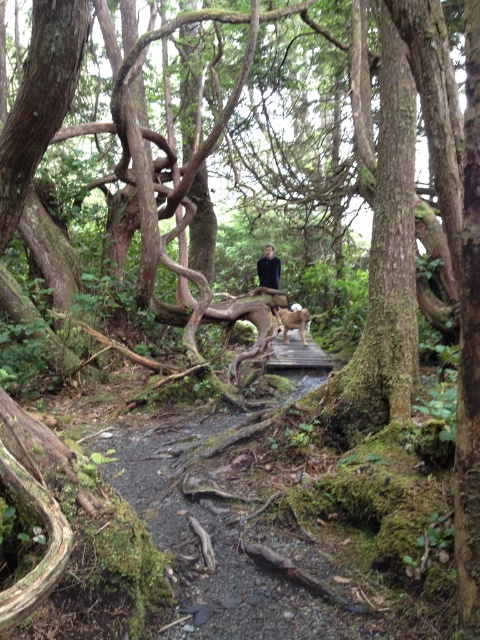
Question: Does black matte shirt at center appear on the right side of brown furry dog at center?

Choices:
 (A) no
 (B) yes

Answer: (A)

Question: Which of the following is the closest to the observer?

Choices:
 (A) (260, 269)
 (B) (289, 310)

Answer: (B)

Question: Is black matte shirt at center in front of brown furry dog at center?

Choices:
 (A) no
 (B) yes

Answer: (A)

Question: Is black matte shirt at center positioned in front of brown furry dog at center?

Choices:
 (A) yes
 (B) no

Answer: (B)

Question: Which of the following is the farthest from the observer?

Choices:
 (A) (303, 323)
 (B) (260, 284)

Answer: (B)